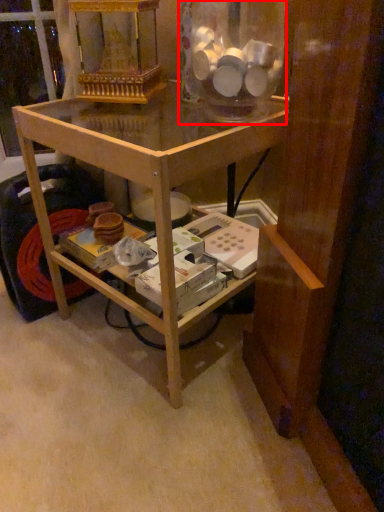
Question: From the image's perspective, what is the correct spatial relationship of glass jar (annotated by the red box) in relation to table?

Choices:
 (A) below
 (B) above

Answer: (B)